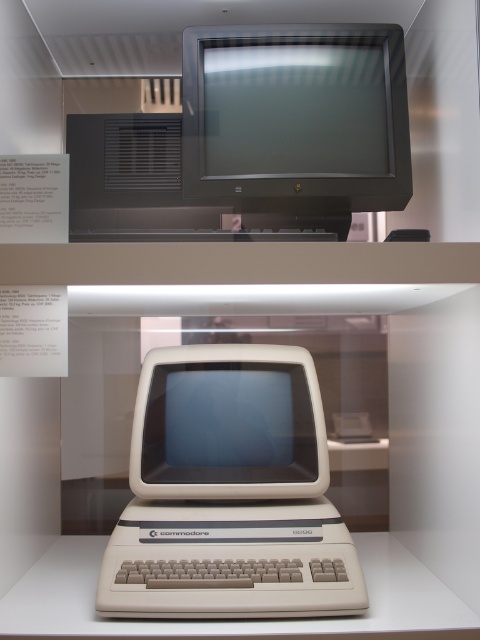
Question: Considering the relative positions of matte black monitor at upper center and beige plastic monitor at center in the image provided, where is matte black monitor at upper center located with respect to beige plastic monitor at center?

Choices:
 (A) right
 (B) left

Answer: (A)

Question: Can you confirm if matte black monitor at upper center is thinner than beige plastic monitor at center?

Choices:
 (A) yes
 (B) no

Answer: (B)

Question: Estimate the real-world distances between objects in this image. Which object is closer to the matte black monitor at upper center?

Choices:
 (A) beige plastic monitor at center
 (B) beige plastic commodore 64 at center

Answer: (A)

Question: Which point is farther to the camera?

Choices:
 (A) (182, 65)
 (B) (251, 396)
 (C) (283, 500)

Answer: (B)

Question: Can you confirm if matte black monitor at upper center is positioned to the right of beige plastic monitor at center?

Choices:
 (A) no
 (B) yes

Answer: (B)

Question: Which object is the farthest from the matte black monitor at upper center?

Choices:
 (A) beige plastic commodore 64 at center
 (B) beige plastic monitor at center

Answer: (A)